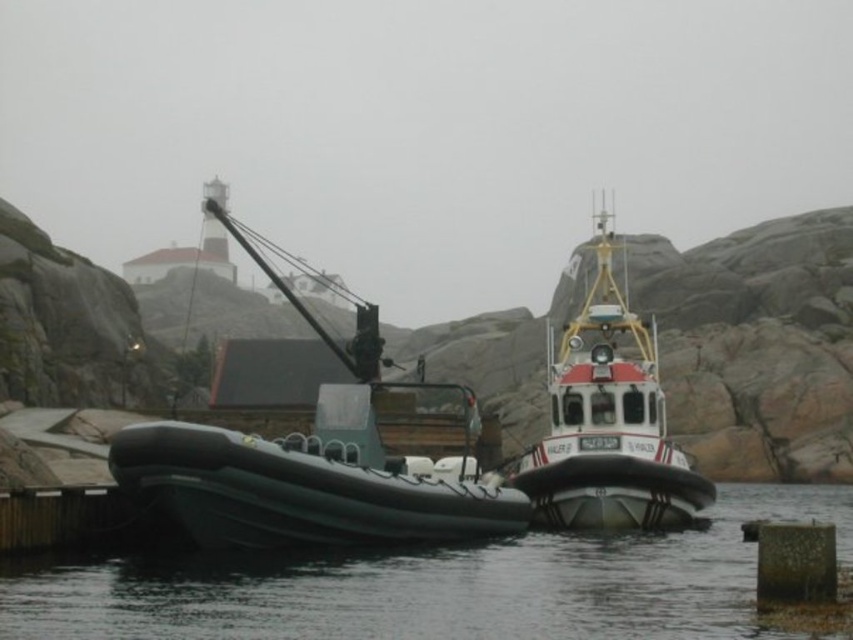
Who is higher up, green rubber boat at center or red and white rubber boat at center?

red and white rubber boat at center is above.

Which of these two, green rubber boat at center or red and white rubber boat at center, stands shorter?

Standing shorter between the two is green rubber boat at center.

Does point (323, 506) lie in front of point (570, 420)?

Yes, point (323, 506) is in front of point (570, 420).

You are a GUI agent. You are given a task and a screenshot of the screen. Output one action in this format:
    pyautogui.click(x=<x>, y=<y>)
    Task: Click on the green rubber boat at center
    
    Given the screenshot: What is the action you would take?
    pyautogui.click(x=311, y=465)

Is the position of black rubber boat at lower left less distant than that of green rubber boat at center?

Yes, it is in front of green rubber boat at center.

Is black rubber boat at lower left to the right of green rubber boat at center from the viewer's perspective?

Indeed, black rubber boat at lower left is positioned on the right side of green rubber boat at center.

Identify the location of black rubber boat at lower left. pyautogui.click(x=433, y=586).

Does black rubber boat at lower left lie behind red and white rubber boat at center?

No.

Does black rubber boat at lower left appear on the right side of red and white rubber boat at center?

No, black rubber boat at lower left is not to the right of red and white rubber boat at center.

Does point (566, 605) come farther from viewer compared to point (584, 520)?

No.

At what (x,y) coordinates should I click in order to perform the action: click on black rubber boat at lower left. Please return your answer as a coordinate pair (x, y). The width and height of the screenshot is (853, 640). Looking at the image, I should click on (433, 586).